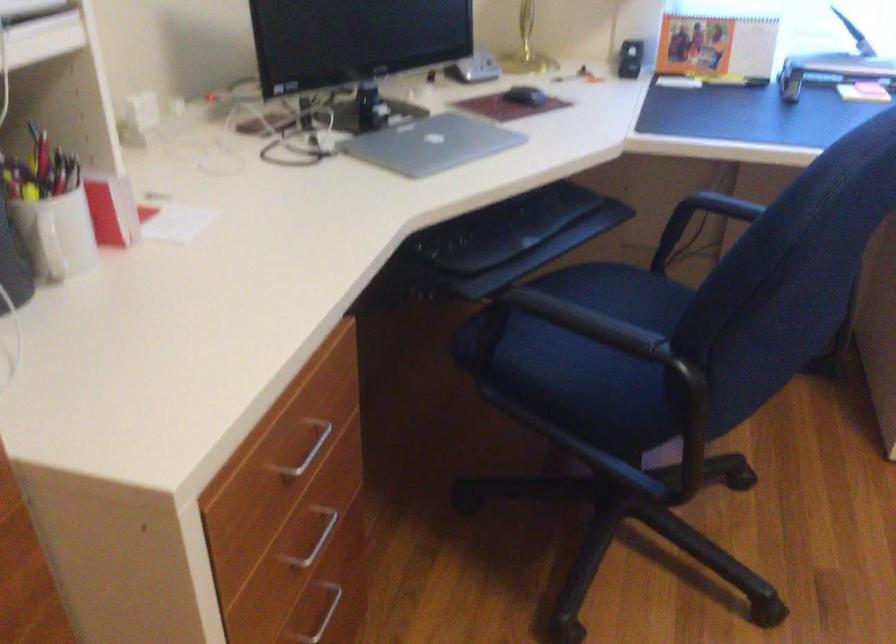
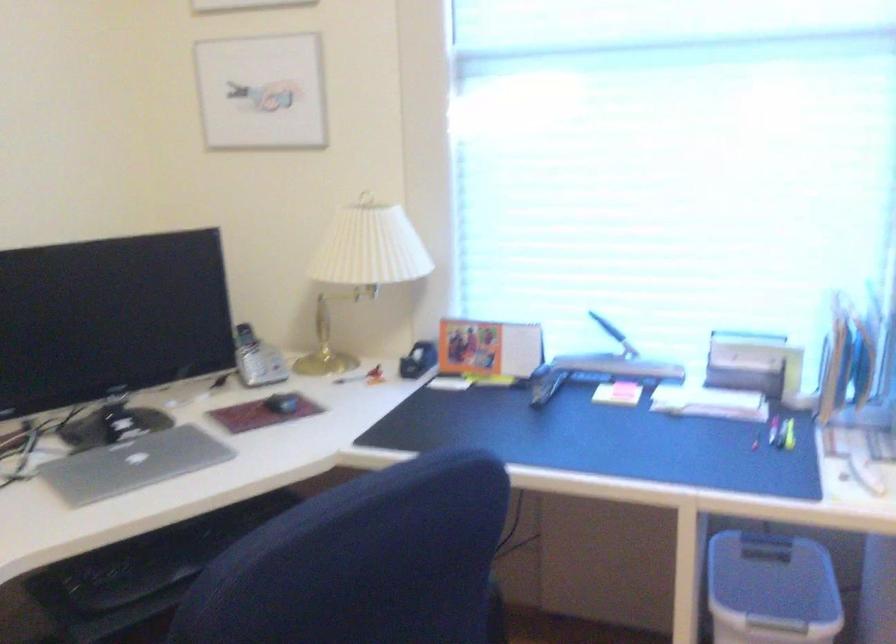
Question: In a continuous first-person perspective shot, in which direction is the camera moving?

Choices:
 (A) Left
 (B) Right
 (C) Forward
 (D) Backward

Answer: (B)